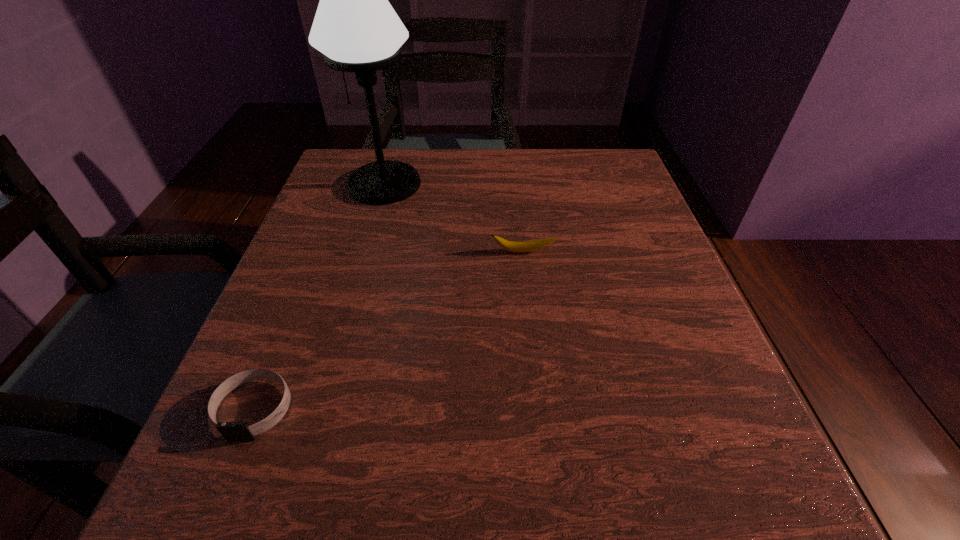
Identify the location of table lamp. (355, 27).

Locate an element on the screen. the farthest object is located at coordinates (355, 27).

Identify the location of the rightmost object. (519, 247).

Find the location of `the second farthest object`. the second farthest object is located at coordinates (519, 247).

I want to click on the nearest object, so click(x=229, y=430).

The width and height of the screenshot is (960, 540). Identify the location of free spot located on the front of the farthest object. (356, 284).

You are a GUI agent. You are given a task and a screenshot of the screen. Output one action in this format:
    pyautogui.click(x=<x>, y=<y>)
    Task: Click on the vacant region located 0.170m on the upward curve of the banana
    
    Given the screenshot: What is the action you would take?
    pyautogui.click(x=531, y=322)

You are a GUI agent. You are given a task and a screenshot of the screen. Output one action in this format:
    pyautogui.click(x=<x>, y=<y>)
    Task: Click on the free space located 0.100m on the outer surface of the wristband
    
    Given the screenshot: What is the action you would take?
    pyautogui.click(x=208, y=523)

The image size is (960, 540). Find the location of `object situated at the far edge`. object situated at the far edge is located at coordinates (355, 27).

The height and width of the screenshot is (540, 960). In order to click on table lamp that is at the left edge in this screenshot , I will do `click(355, 27)`.